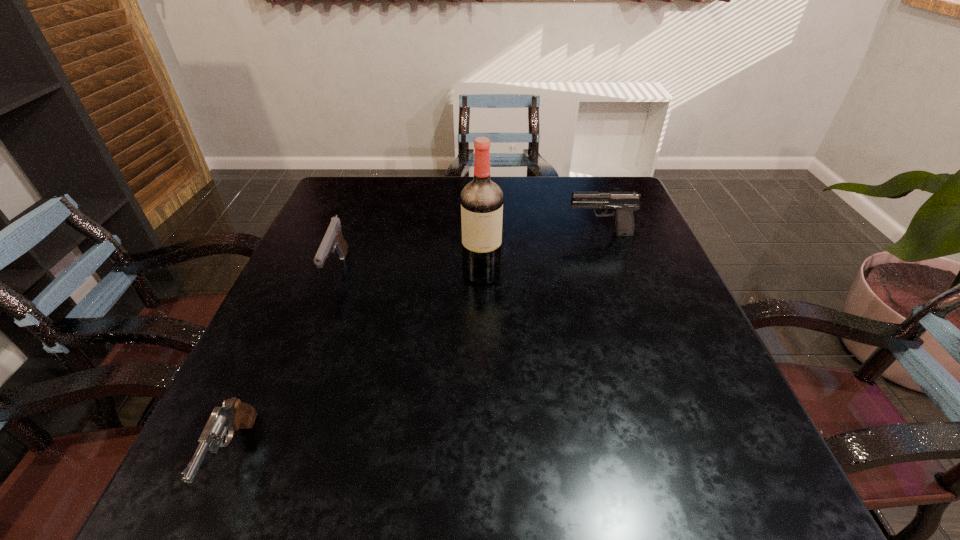
Where is `vacant area at the far right corner`? The width and height of the screenshot is (960, 540). vacant area at the far right corner is located at coordinates (593, 192).

Locate an element on the screen. Image resolution: width=960 pixels, height=540 pixels. vacant space that's between the leftmost pistol and the farthest object is located at coordinates (417, 345).

This screenshot has height=540, width=960. I want to click on free space between the liquor and the second pistol from right to left, so click(x=410, y=272).

Where is `free space between the liquor and the rightmost pistol`? free space between the liquor and the rightmost pistol is located at coordinates (540, 253).

Where is `free space between the rightmost pistol and the tallest object`? This screenshot has width=960, height=540. free space between the rightmost pistol and the tallest object is located at coordinates pyautogui.click(x=540, y=253).

Identify the location of free point between the third object from right to left and the second object from right to left. The height and width of the screenshot is (540, 960). tap(410, 272).

The width and height of the screenshot is (960, 540). Identify the location of free point between the nearest pistol and the liquor. (358, 364).

Find the location of a particular element. vacant point located between the second pistol from left to right and the tallest object is located at coordinates (410, 272).

Where is `vacant area that lies between the leftmost object and the rightmost pistol`? vacant area that lies between the leftmost object and the rightmost pistol is located at coordinates (417, 345).

Identify which object is the second closest to the farthest pistol. Please provide its 2D coordinates. Your answer should be formatted as a tuple, i.e. [(x, y)], where the tuple contains the x and y coordinates of a point satisfying the conditions above.

[(333, 237)]